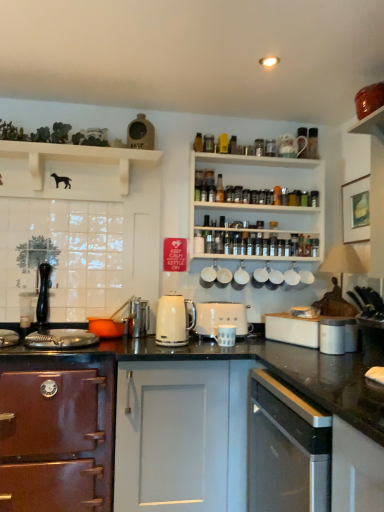
What is the approximate width of white matte toaster at center, which is the 3th appliance from left to right?

white matte toaster at center, which is the 3th appliance from left to right, is 6.15 inches wide.

Find the location of a particular element. This screenshot has width=384, height=512. white matte cup at upper center, which ranks as the eighth appliance in left-to-right order is located at coordinates tap(275, 276).

The height and width of the screenshot is (512, 384). I want to click on white wooden shelf at upper center, which appears as the 2th shelf when viewed from the left, so click(x=263, y=189).

How different are the orientations of white glossy mug at center, the sixth appliance in the right-to-left sequence, and black matte faucet at left in degrees?

They differ by 2.11 degrees in their facing directions.

From the image's perspective, relative to black matte faucet at left, is white glossy mug at center, the sixth appliance in the right-to-left sequence, above or below?

Clearly, from the image's perspective, white glossy mug at center, the sixth appliance in the right-to-left sequence, is below black matte faucet at left.

Does white glossy mug at center, the sixth appliance in the right-to-left sequence, contain black matte faucet at left?

That's incorrect, black matte faucet at left is not inside white glossy mug at center, the sixth appliance in the right-to-left sequence.

Considering the positions of objects white glossy mug at center, which appears as the fourth appliance when viewed from the left, and black matte faucet at left in the image provided, who is more to the left, white glossy mug at center, which appears as the fourth appliance when viewed from the left, or black matte faucet at left?

black matte faucet at left.

Considering the sizes of objects white ceramic mug at upper center, marked as the 5th appliance in a left-to-right arrangement, and black matte faucet at left in the image provided, who is taller, white ceramic mug at upper center, marked as the 5th appliance in a left-to-right arrangement, or black matte faucet at left?

black matte faucet at left is taller.

Can you confirm if white ceramic mug at upper center, acting as the fifth appliance starting from the right, is positioned to the left of black matte faucet at left?

No, white ceramic mug at upper center, acting as the fifth appliance starting from the right, is not to the left of black matte faucet at left.

Does point (222, 281) come farther from viewer compared to point (40, 275)?

Yes, it is.

Would you say white ceramic mugs at center, which is the fourth appliance from right to left, is inside or outside cream matte electric kettle at center?

white ceramic mugs at center, which is the fourth appliance from right to left, lies outside cream matte electric kettle at center.

From a real-world perspective, which is physically above, white ceramic mugs at center, which is the sixth appliance in left-to-right order, or cream matte electric kettle at center?

white ceramic mugs at center, which is the sixth appliance in left-to-right order, is physically above.

Considering the relative positions of white ceramic mugs at center, which is the fourth appliance from right to left, and cream matte electric kettle at center in the image provided, is white ceramic mugs at center, which is the fourth appliance from right to left, to the left of cream matte electric kettle at center from the viewer's perspective?

In fact, white ceramic mugs at center, which is the fourth appliance from right to left, is to the right of cream matte electric kettle at center.

From a real-world perspective, is white ceramic mug at upper center, which is counted as the second appliance, starting from the left, positioned under white matte cup at upper center, which ranks as the eighth appliance in left-to-right order, based on gravity?

No, from a real-world perspective, white ceramic mug at upper center, which is counted as the second appliance, starting from the left, is not under white matte cup at upper center, which ranks as the eighth appliance in left-to-right order.

There is a white matte cup at upper center, which ranks as the eighth appliance in left-to-right order. At what (x,y) coordinates should I click in order to perform the action: click on the 1st appliance above it (from a real-world perspective). Please return your answer as a coordinate pair (x, y). Looking at the image, I should click on (209, 274).

Can you confirm if white ceramic mug at upper center, which is counted as the second appliance, starting from the left, is wider than white matte cup at upper center, positioned as the 2th appliance in right-to-left order?

In fact, white ceramic mug at upper center, which is counted as the second appliance, starting from the left, might be narrower than white matte cup at upper center, positioned as the 2th appliance in right-to-left order.

Between white ceramic mug at upper center, which is counted as the second appliance, starting from the left, and white matte cup at upper center, which ranks as the eighth appliance in left-to-right order, which one appears on the right side from the viewer's perspective?

white matte cup at upper center, which ranks as the eighth appliance in left-to-right order, is more to the right.

Is black granite countertop at center oriented away from satin silver dishwasher at lower right, acting as the second cabinetry starting from the left?

No, black granite countertop at center is not facing away from satin silver dishwasher at lower right, acting as the second cabinetry starting from the left.

Considering the relative positions of black granite countertop at center and satin silver dishwasher at lower right, acting as the second cabinetry starting from the left, in the image provided, is black granite countertop at center in front of satin silver dishwasher at lower right, acting as the second cabinetry starting from the left,?

No, black granite countertop at center is further to the viewer.

Considering the relative sizes of black granite countertop at center and satin silver dishwasher at lower right, acting as the second cabinetry starting from the left, in the image provided, is black granite countertop at center smaller than satin silver dishwasher at lower right, acting as the second cabinetry starting from the left,?

Actually, black granite countertop at center might be larger than satin silver dishwasher at lower right, acting as the second cabinetry starting from the left.

Would you say black granite countertop at center contains satin silver dishwasher at lower right, acting as the second cabinetry starting from the left?

No, satin silver dishwasher at lower right, acting as the second cabinetry starting from the left, is not surrounded by black granite countertop at center.

Looking at their sizes, would you say black matte dog at upper left is wider or thinner than white ceramic mug at upper center, acting as the fifth appliance starting from the right?

Considering their sizes, black matte dog at upper left looks slimmer than white ceramic mug at upper center, acting as the fifth appliance starting from the right.

How many degrees apart are the facing directions of black matte dog at upper left and white ceramic mug at upper center, acting as the fifth appliance starting from the right?

black matte dog at upper left and white ceramic mug at upper center, acting as the fifth appliance starting from the right, are facing 4.14 degrees away from each other.

Based on their sizes in the image, would you say black matte dog at upper left is bigger or smaller than white ceramic mug at upper center, acting as the fifth appliance starting from the right?

Considering their sizes, black matte dog at upper left takes up less space than white ceramic mug at upper center, acting as the fifth appliance starting from the right.

Between white wood shelf at upper left, marked as the second shelf in a right-to-left arrangement, and matte brown oven at left, the first cabinetry when ordered from left to right, which one has smaller size?

white wood shelf at upper left, marked as the second shelf in a right-to-left arrangement, is smaller.

In the image, is white wood shelf at upper left, marked as the second shelf in a right-to-left arrangement, positioned in front of or behind matte brown oven at left, the first cabinetry when ordered from left to right?

white wood shelf at upper left, marked as the second shelf in a right-to-left arrangement, is positioned farther from the viewer than matte brown oven at left, the first cabinetry when ordered from left to right.

Considering the relative positions of white wood shelf at upper left, marked as the second shelf in a right-to-left arrangement, and matte brown oven at left, marked as the second cabinetry in a right-to-left arrangement, in the image provided, is white wood shelf at upper left, marked as the second shelf in a right-to-left arrangement, to the right of matte brown oven at left, marked as the second cabinetry in a right-to-left arrangement, from the viewer's perspective?

Yes, white wood shelf at upper left, marked as the second shelf in a right-to-left arrangement, is to the right of matte brown oven at left, marked as the second cabinetry in a right-to-left arrangement.

Is matte brown oven at left, the first cabinetry when ordered from left to right, completely or partially inside white wood shelf at upper left, the 1th shelf in the front-to-back sequence?

That's incorrect, matte brown oven at left, the first cabinetry when ordered from left to right, is not inside white wood shelf at upper left, the 1th shelf in the front-to-back sequence.

You are a GUI agent. You are given a task and a screenshot of the screen. Output one action in this format:
    pyautogui.click(x=<x>, y=<y>)
    Task: Click on the faucet above the white glossy mug at center, the sixth appliance in the right-to-left sequence (from a real-world perspective)
    The width and height of the screenshot is (384, 512).
    Given the screenshot: What is the action you would take?
    coord(43,296)

The width and height of the screenshot is (384, 512). In the image, there is a white ceramic mug at upper center, acting as the fifth appliance starting from the right. Find the location of `faucet below it (from a real-world perspective)`. faucet below it (from a real-world perspective) is located at coordinates (43, 296).

Looking at the image, which one is located closer to cream matte electric kettle at center, white matte coffee cup at center, positioned as the seventh appliance in left-to-right order, or white wooden shelf at upper center, positioned as the first shelf in back-to-front order?

white matte coffee cup at center, positioned as the seventh appliance in left-to-right order.

Consider the image. Estimate the real-world distances between objects in this image. Which object is closer to cream matte electric kettle at center, satin silver dishwasher at lower right, acting as the second cabinetry starting from the left, or black matte faucet at left?

satin silver dishwasher at lower right, acting as the second cabinetry starting from the left, is positioned closer to the anchor cream matte electric kettle at center.

When comparing their distances from cream matte electric kettle at center, does white ceramic mug at upper center, marked as the 5th appliance in a left-to-right arrangement, or black matte dog at upper left seem closer?

white ceramic mug at upper center, marked as the 5th appliance in a left-to-right arrangement, is closer to cream matte electric kettle at center.

When comparing their distances from white ceramic mug at upper center, marked as the 8th appliance in a right-to-left arrangement, does metallic silver canisters at center, the ninth appliance positioned from the right, or black granite countertop at center seem closer?

The object closer to white ceramic mug at upper center, marked as the 8th appliance in a right-to-left arrangement, is metallic silver canisters at center, the ninth appliance positioned from the right.

Considering their positions, is white wood shelf at upper left, the first shelf when ordered from left to right, positioned closer to black granite countertop at center than white matte cup at upper center, which ranks as the eighth appliance in left-to-right order?

Based on the image, white matte cup at upper center, which ranks as the eighth appliance in left-to-right order, appears to be nearer to black granite countertop at center.

Estimate the real-world distances between objects in this image. Which object is further from white ceramic mugs at center, which is the fourth appliance from right to left, white ceramic mug at upper center, marked as the 5th appliance in a left-to-right arrangement, or white matte toaster at center, which is counted as the 7th appliance, starting from the right?

Among the two, white matte toaster at center, which is counted as the 7th appliance, starting from the right, is located further to white ceramic mugs at center, which is the fourth appliance from right to left.

Estimate the real-world distances between objects in this image. Which object is further from white matte coffee cup at center, which ranks as the third appliance in right-to-left order, cream matte electric kettle at center or white matte toaster at center, which is the 3th appliance from left to right?

cream matte electric kettle at center is positioned further to the anchor white matte coffee cup at center, which ranks as the third appliance in right-to-left order.

Based on the photo, looking at the image, which one is located closer to cream matte electric kettle at center, white matte coffee cup at center, the ninth appliance when ordered from left to right, or white ceramic mugs at center, which is the fourth appliance from right to left?

The object closer to cream matte electric kettle at center is white ceramic mugs at center, which is the fourth appliance from right to left.

I want to click on animal between white wood shelf at upper left, marked as the second shelf in a right-to-left arrangement, and cream matte electric kettle at center from top to bottom, so click(62, 180).

Where is `shelf between black matte faucet at left and white wooden shelf at upper center, arranged as the second shelf when viewed from the front`? shelf between black matte faucet at left and white wooden shelf at upper center, arranged as the second shelf when viewed from the front is located at coordinates (77, 157).

What are the coordinates of `animal situated between black matte faucet at left and white matte cup at upper center, positioned as the 2th appliance in right-to-left order, from left to right` in the screenshot? It's located at (62, 180).

Locate an element on the screen. faucet between white wood shelf at upper left, the first shelf when ordered from left to right, and metallic silver canisters at center, the ninth appliance positioned from the right, vertically is located at coordinates (43, 296).